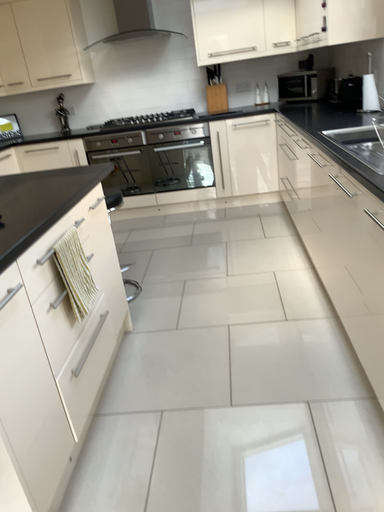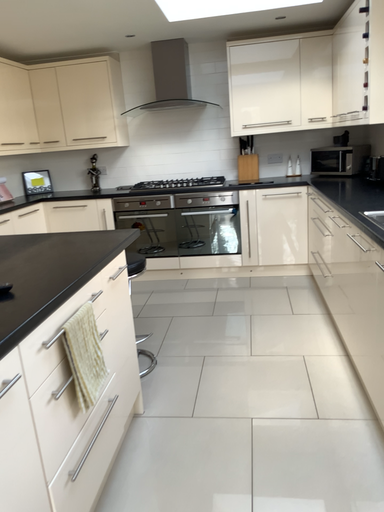
Question: How did the camera likely rotate when shooting the video?

Choices:
 (A) rotated upward
 (B) rotated downward

Answer: (A)